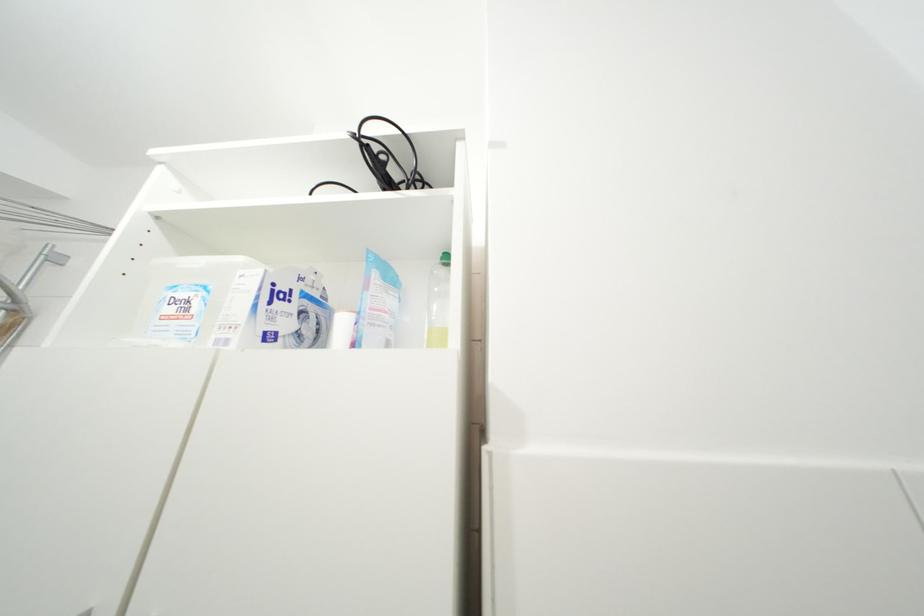
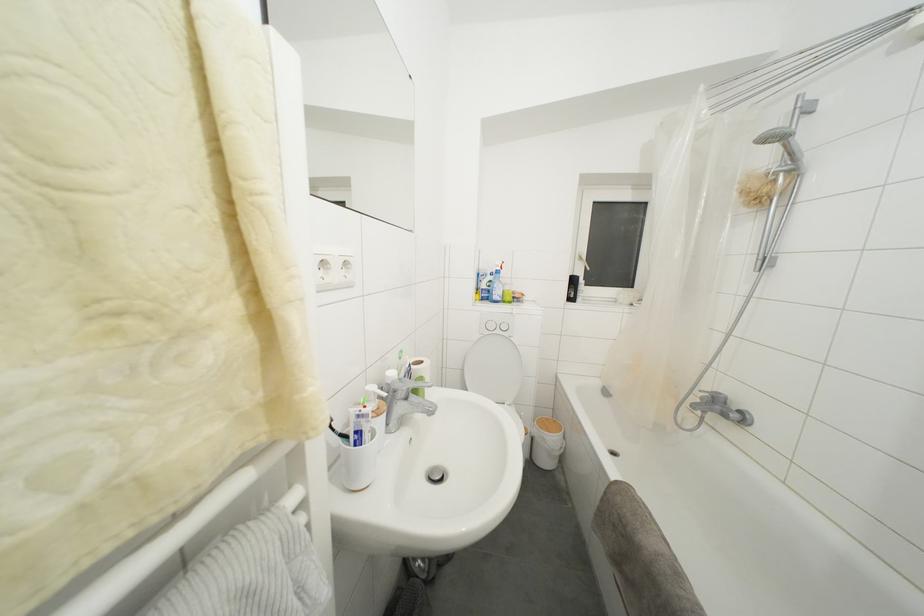
Question: How did the camera likely rotate?

Choices:
 (A) Left
 (B) Right
 (C) Up
 (D) Down

Answer: (A)